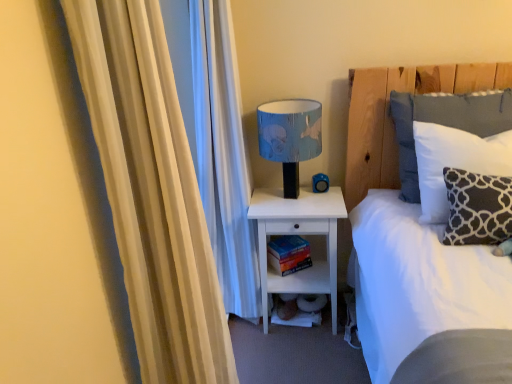
Where is `blank space situated above hardcover book at lower center (from a real-world perspective)`? The image size is (512, 384). blank space situated above hardcover book at lower center (from a real-world perspective) is located at coordinates (288, 247).